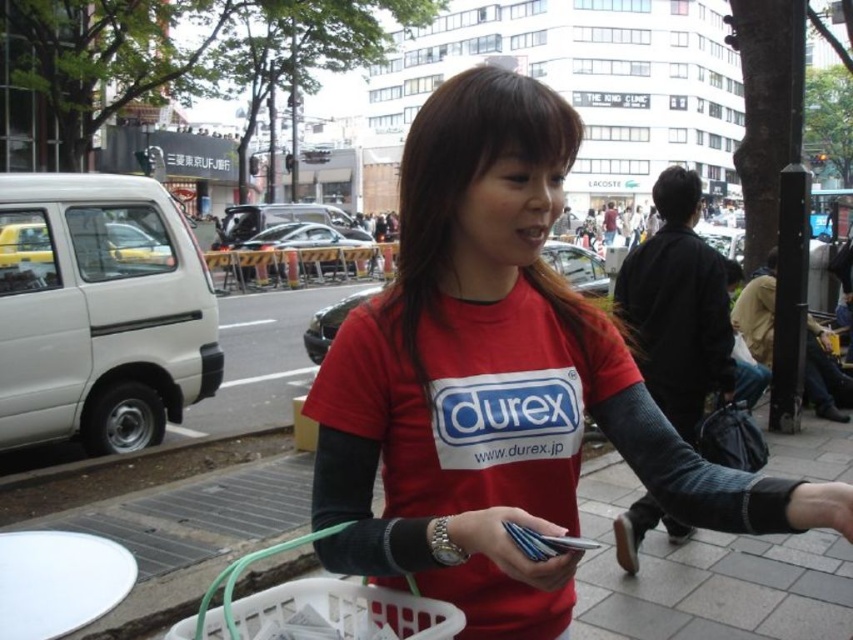
You are a delivery person who needs to place a small package in the white plastic basket at lower center. However, there are metallic silver cards at center nearby. Where should you place the package to ensure it goes into the basket and not the cards?

The white plastic basket at lower center is to the left of the metallic silver cards at center, so you should place the package to the left side of the metallic silver cards at center to ensure it goes into the basket instead of the cards.

Based on the photo, you are standing at the point marked as point (316, 608) in the image. Looking around, you see a white plastic basket at lower center. What object is located at the coordinates you are standing on?

The coordinates point (316, 608) correspond to the white plastic basket at lower center.